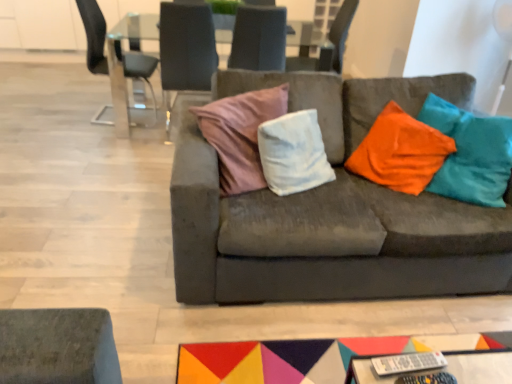
You are a GUI agent. You are given a task and a screenshot of the screen. Output one action in this format:
    pyautogui.click(x=<x>, y=<y>)
    Task: Click on the blank space to the left of suede couch at center
    This screenshot has width=512, height=384.
    Given the screenshot: What is the action you would take?
    pyautogui.click(x=106, y=221)